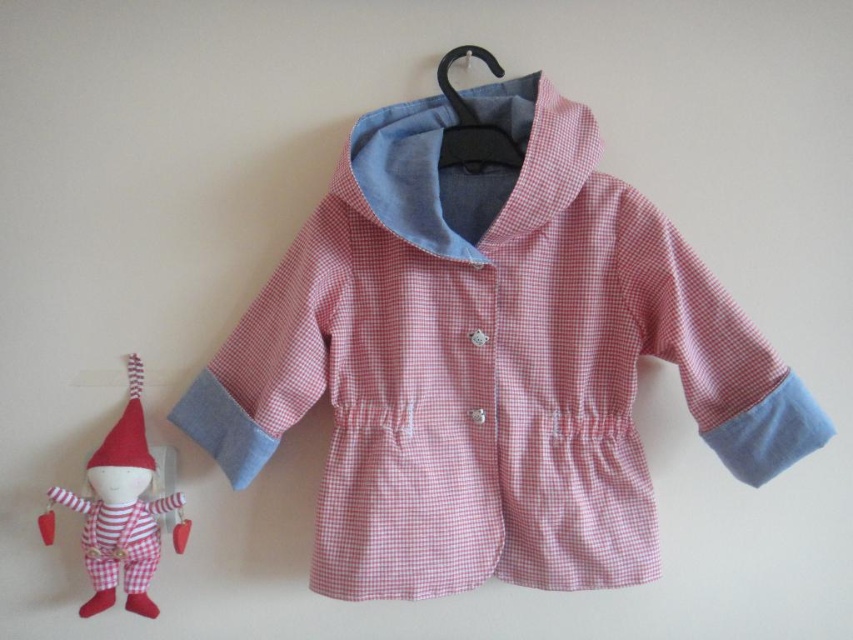
Is pink gingham fabric coat at center to the left of red felt christmas hat at left from the viewer's perspective?

In fact, pink gingham fabric coat at center is to the right of red felt christmas hat at left.

Measure the distance from pink gingham fabric coat at center to red felt christmas hat at left.

pink gingham fabric coat at center and red felt christmas hat at left are 16.95 inches apart.

Is point (346, 218) less distant than point (132, 403)?

Yes, point (346, 218) is in front of point (132, 403).

I want to click on pink gingham fabric coat at center, so click(x=488, y=364).

Measure the distance from red fabric elf at left to black plastic hanger at upper center.

red fabric elf at left is 23.17 inches away from black plastic hanger at upper center.

Consider the image. Can you confirm if red fabric elf at left is wider than black plastic hanger at upper center?

Yes.

Who is more forward, (155, 513) or (471, 49)?

Point (471, 49) is more forward.

Locate an element on the screen. The width and height of the screenshot is (853, 640). red fabric elf at left is located at coordinates (120, 509).

Is red fabric elf at left further to camera compared to red felt christmas hat at left?

No, red fabric elf at left is in front of red felt christmas hat at left.

Does red fabric elf at left lie in front of red felt christmas hat at left?

Yes, it is.

Locate an element on the screen. red fabric elf at left is located at coordinates (120, 509).

The width and height of the screenshot is (853, 640). I want to click on red fabric elf at left, so click(x=120, y=509).